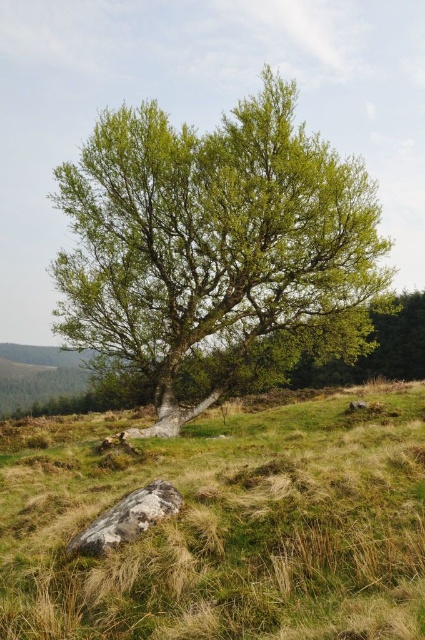
Which is more to the right, green grass at lower center or green leafy tree at center?

green grass at lower center is more to the right.

Does green grass at lower center appear over green leafy tree at center?

No, green grass at lower center is not above green leafy tree at center.

Does point (246, 588) come behind point (124, 157)?

No, (246, 588) is in front of (124, 157).

In order to click on green grass at lower center in this screenshot , I will do `click(223, 524)`.

Does point (289, 451) lie behind point (129, 499)?

Yes, it is.

Who is lower down, green grass at lower center or gray rough rock at lower center?

green grass at lower center is below.

Between point (408, 440) and point (152, 486), which one is positioned in front?

Point (152, 486) is in front.

Where is `green grass at lower center`? The image size is (425, 640). green grass at lower center is located at coordinates (223, 524).

What do you see at coordinates (217, 250) in the screenshot? This screenshot has width=425, height=640. I see `green leafy tree at center` at bounding box center [217, 250].

In order to click on green leafy tree at center in this screenshot , I will do point(217,250).